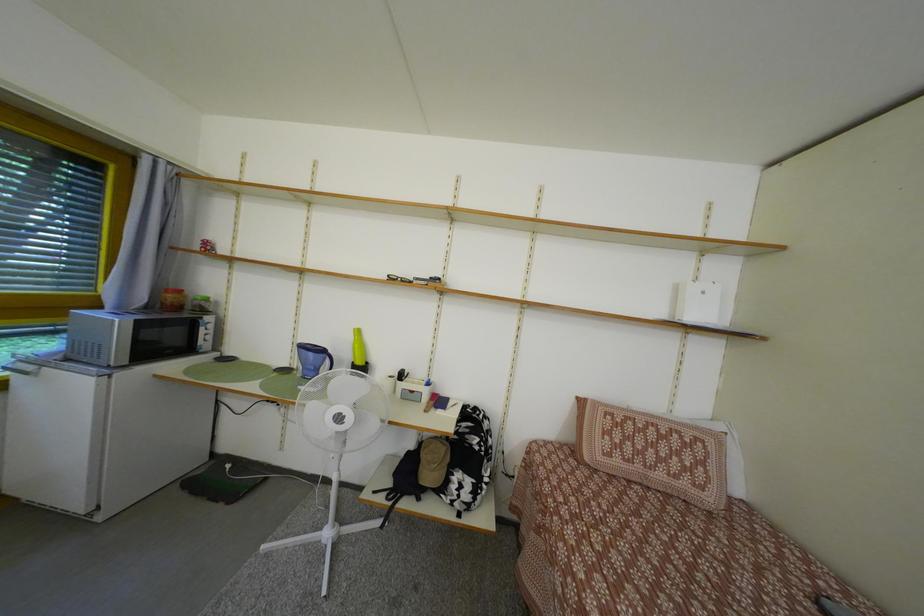
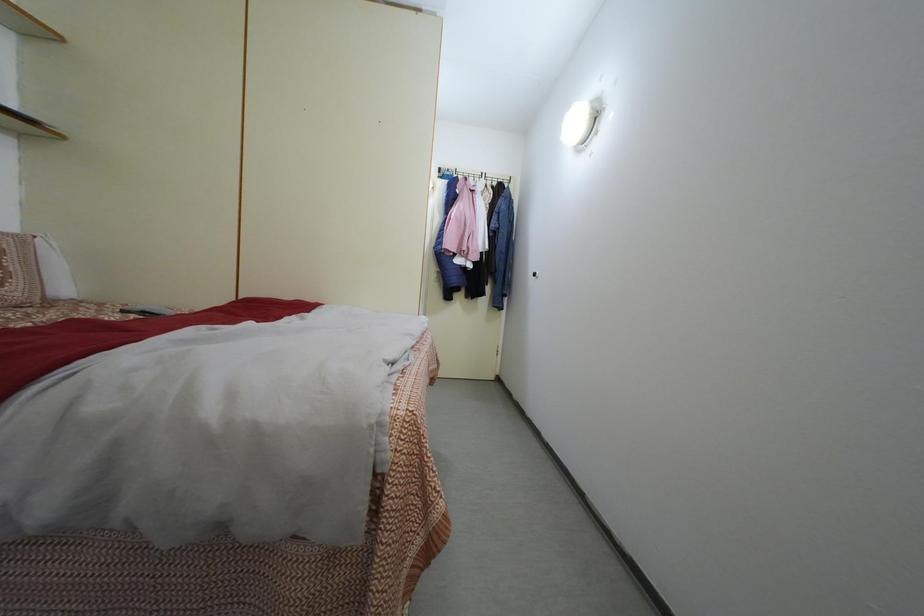
Question: The camera is either moving clockwise (left) or counter-clockwise (right) around the object. The first image is from the beginning of the video and the second image is from the end. Is the camera moving left or right when shooting the video?

Choices:
 (A) Left
 (B) Right

Answer: (A)